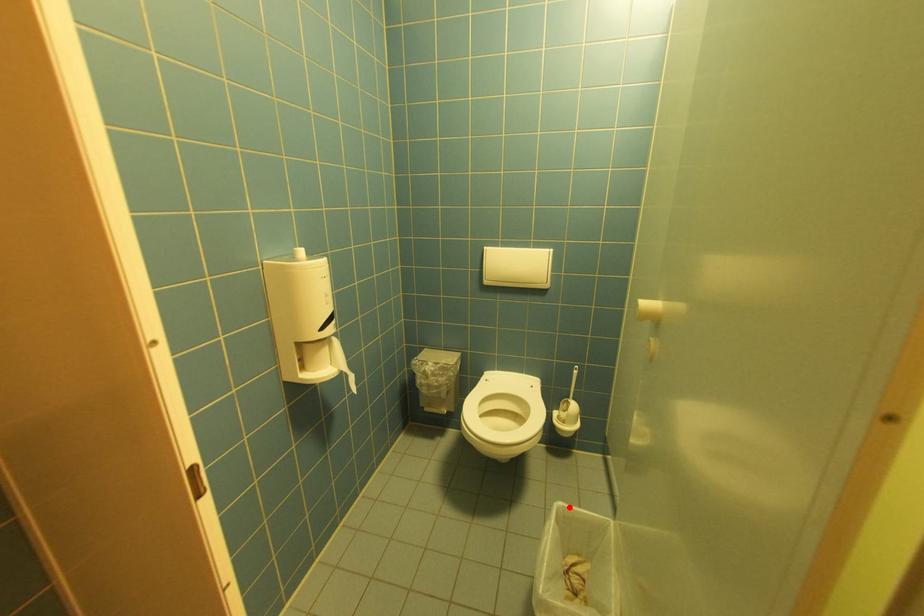
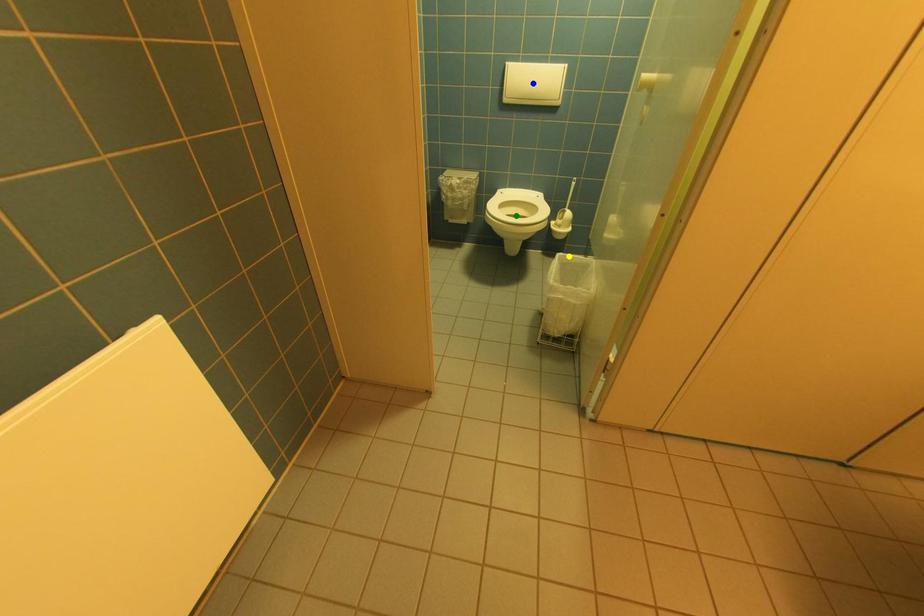
Question: I am providing you with two images of the same scene from different viewpoints. A red point is marked on the first image. You are given multiple points on the second image. Which mark in image 2 goes with the point in image 1?

Choices:
 (A) yellow point
 (B) blue point
 (C) green point

Answer: (A)